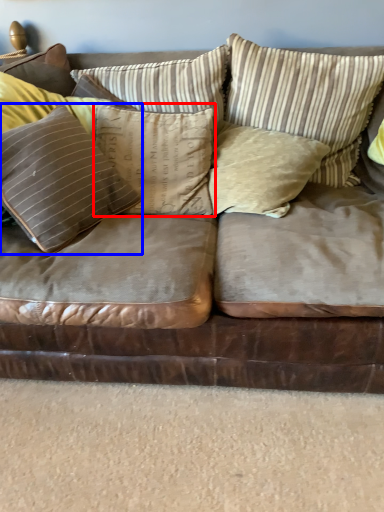
Question: Among these objects, which one is farthest to the camera, pillow (highlighted by a red box) or pillow (highlighted by a blue box)?

Choices:
 (A) pillow
 (B) pillow

Answer: (A)